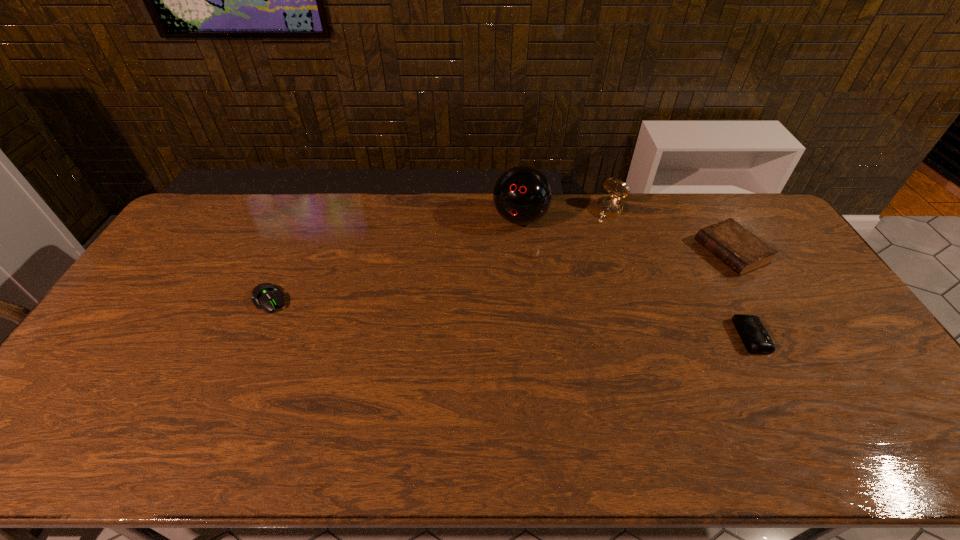
Identify the location of compass located in the far edge section of the desktop. This screenshot has height=540, width=960. (608, 206).

The width and height of the screenshot is (960, 540). I want to click on diary that is at the far edge, so click(742, 251).

Locate an element on the screen. The image size is (960, 540). object that is at the right edge is located at coordinates (742, 251).

Identify the location of object located at the far right corner. (742, 251).

The image size is (960, 540). In order to click on free spot at the far edge of the desktop in this screenshot , I will do `click(346, 203)`.

The image size is (960, 540). What are the coordinates of `free space at the near edge of the desktop` in the screenshot? It's located at (792, 393).

Where is `vacant space at the left edge of the desktop`? The width and height of the screenshot is (960, 540). vacant space at the left edge of the desktop is located at coordinates (127, 353).

Identify the location of vacant area at the right edge. Image resolution: width=960 pixels, height=540 pixels. (783, 298).

Identify the location of unoccupied position between the diary and the fourth shortest object. (670, 231).

Where is `vacant area that lies between the diary and the nearest object`? The width and height of the screenshot is (960, 540). vacant area that lies between the diary and the nearest object is located at coordinates (742, 294).